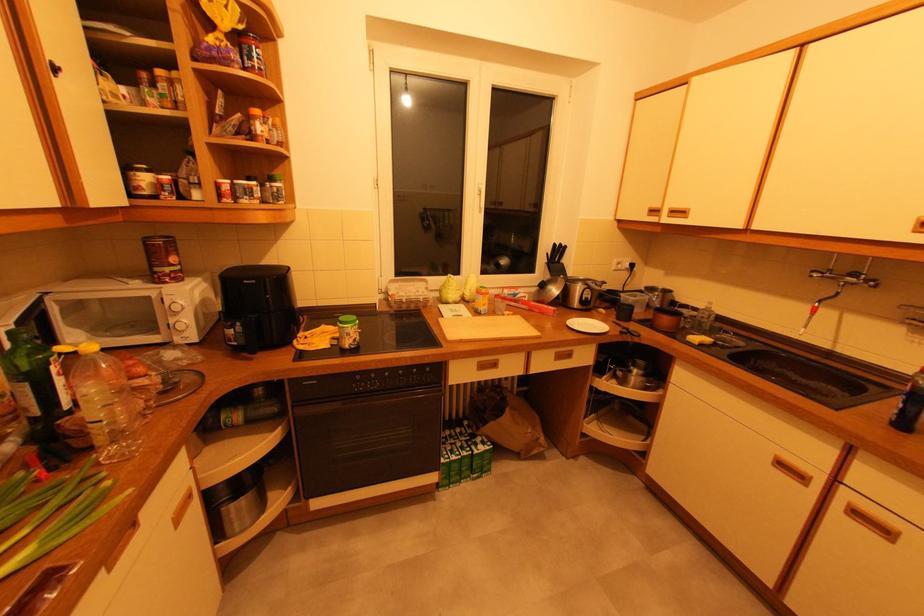
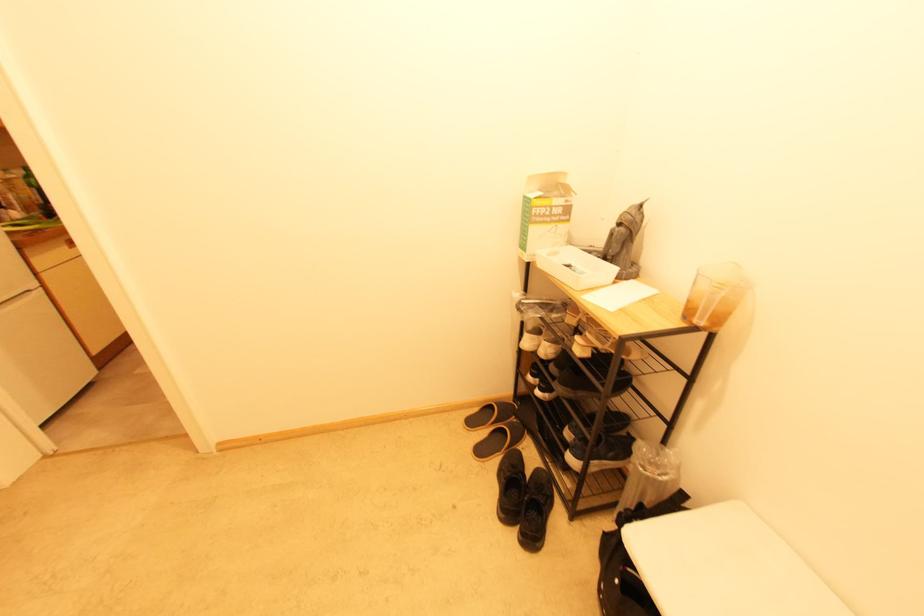
Question: I am providing you with two images of the same scene from different viewpoints. Which of the following objects are not visible in image2?

Choices:
 (A) black plastic bottle
 (B) white chair handle
 (C) white shoe
 (D) white plastic tray

Answer: (A)